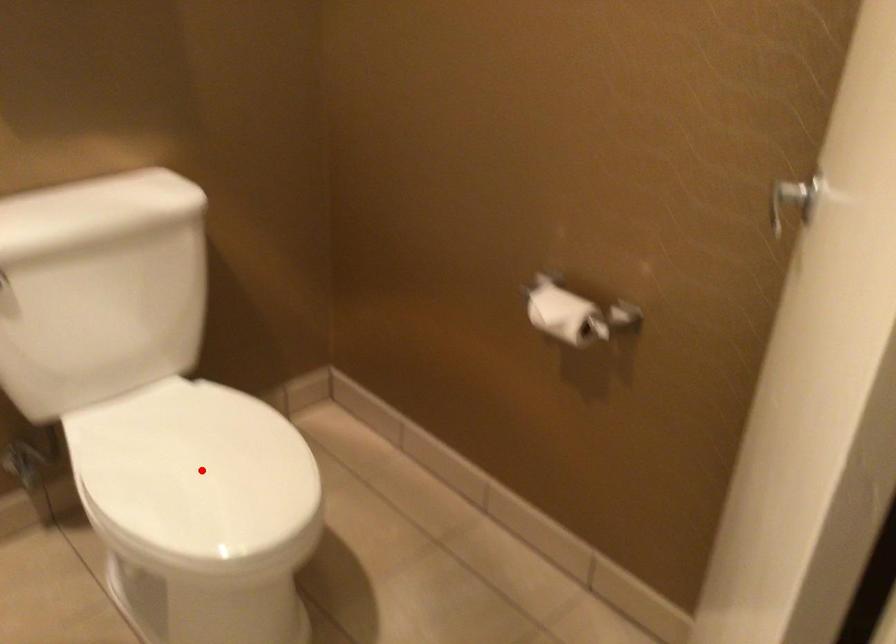
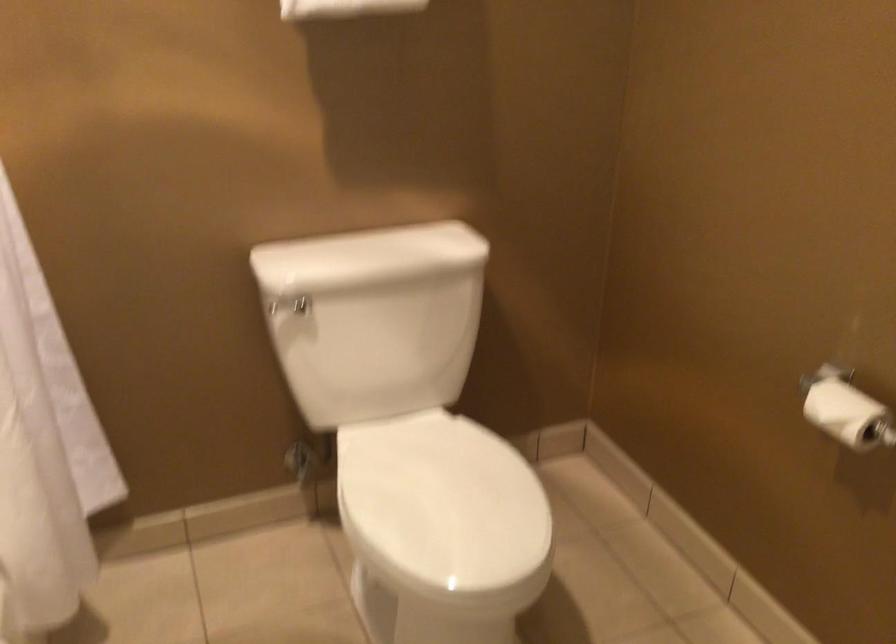
Question: I am providing you with two images of the same scene from different viewpoints. A red point is marked on the first image. At the location where the point appears in image 1, is it still visible in image 2?

Choices:
 (A) Yes
 (B) No

Answer: (A)